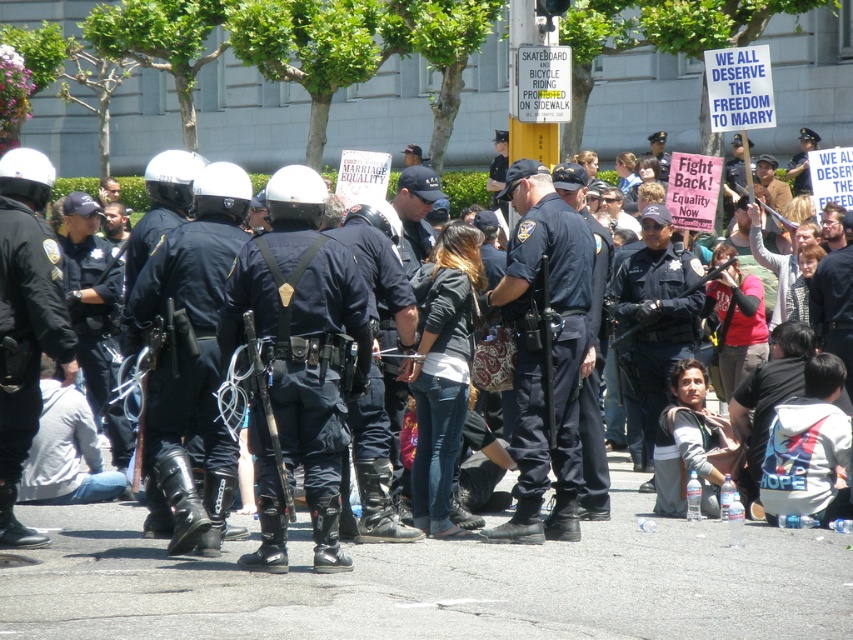
Is the position of matte black helmet at center more distant than that of black uniformed officer at center?

No.

Does matte black helmet at center have a lesser height compared to black uniformed officer at center?

Correct, matte black helmet at center is not as tall as black uniformed officer at center.

Where is `matte black helmet at center`? The height and width of the screenshot is (640, 853). matte black helmet at center is located at coordinates (265, 368).

Where is `matte black helmet at center`? The width and height of the screenshot is (853, 640). matte black helmet at center is located at coordinates (265, 368).

In the scene shown: Does black matte uniform at center have a greater width compared to matte black helmet at left?

Yes.

Which is behind, point (236, 188) or point (3, 474)?

Point (236, 188)

Is point (172, 504) behind point (33, 301)?

No, it is in front of (33, 301).

Locate an element on the screen. This screenshot has width=853, height=640. black matte uniform at center is located at coordinates pyautogui.click(x=193, y=356).

Does matte black helmet at center have a greater height compared to black matte uniform at center?

No, matte black helmet at center is not taller than black matte uniform at center.

Who is taller, matte black helmet at center or black matte uniform at center?

Standing taller between the two is black matte uniform at center.

Identify the location of matte black helmet at center. The image size is (853, 640). (265, 368).

At what (x,y) coordinates should I click in order to perform the action: click on matte black helmet at center. Please return your answer as a coordinate pair (x, y). This screenshot has width=853, height=640. Looking at the image, I should click on (265, 368).